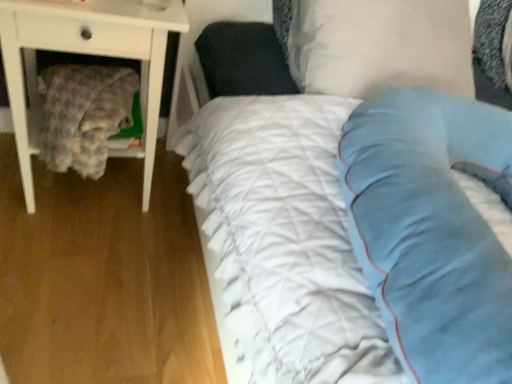
Find the location of a particular element. free spot to the right of white wood nightstand at left is located at coordinates (165, 234).